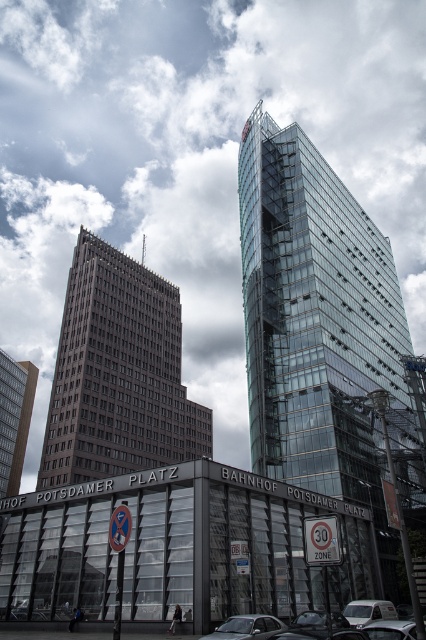
You are a pedestrian standing at the crosswalk between the two buildings. You see a metallic silver car at lower center and a silver metallic car at lower right. Which car is closer to the tall, rectangular building with a dark facade on the left?

The metallic silver car at lower center is closer to the tall, rectangular building with a dark facade on the left because it is positioned to the left of the silver metallic car at lower right.